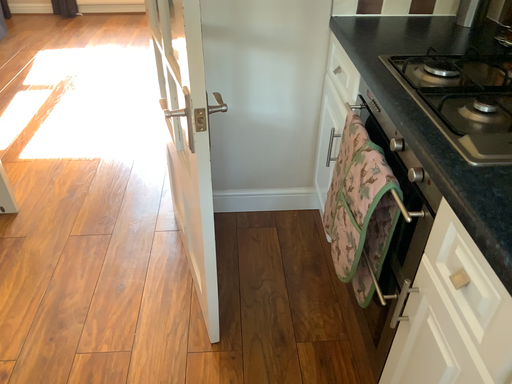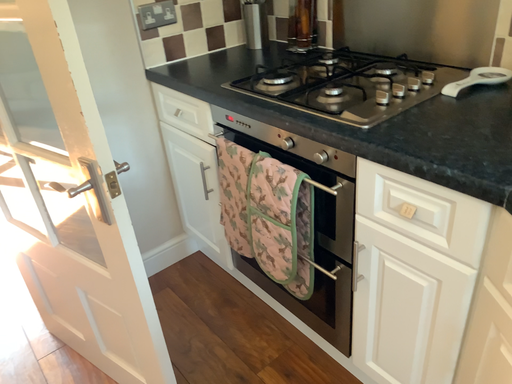
Question: How did the camera likely rotate when shooting the video?

Choices:
 (A) rotated upward
 (B) rotated downward

Answer: (A)